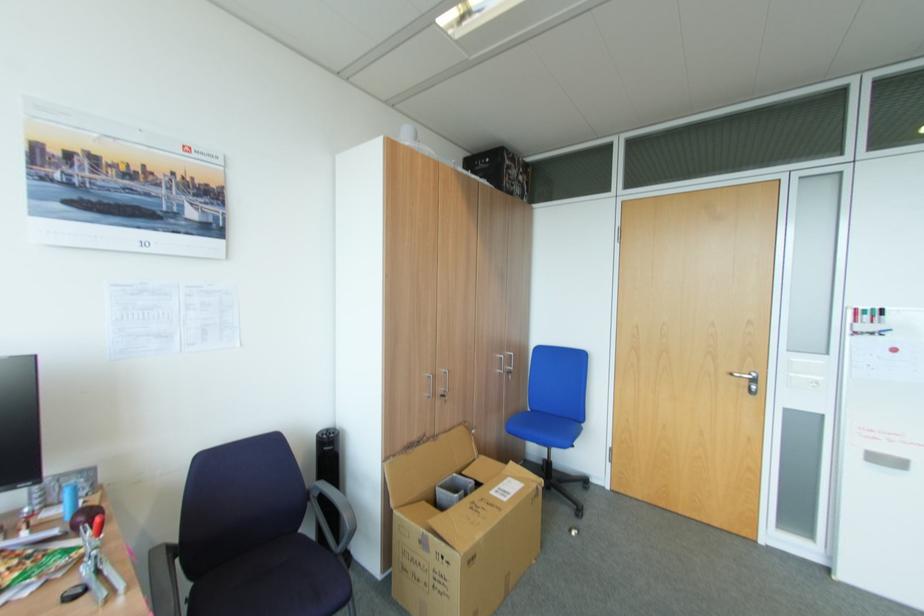
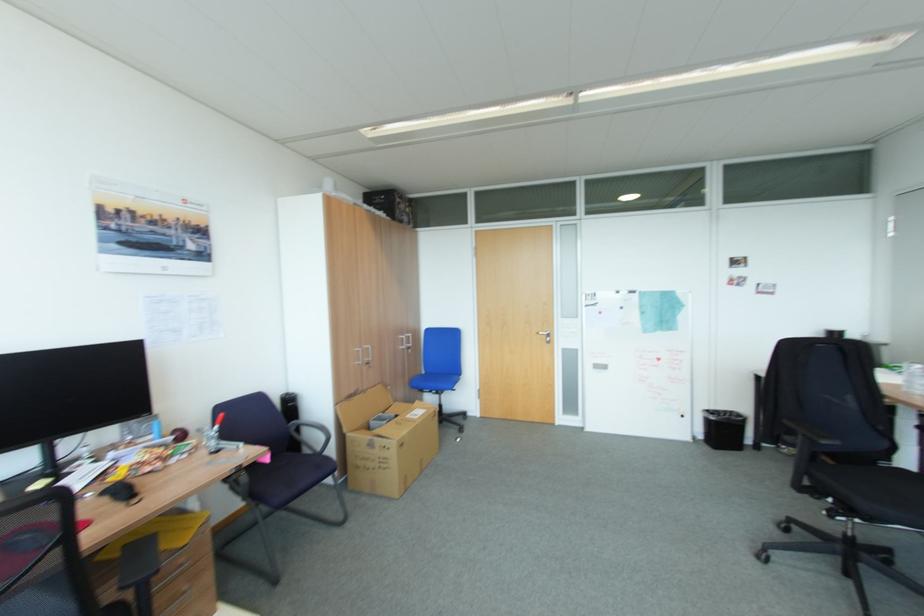
Question: Which direction would the cameraman need to move to produce the second image? Reply with the corresponding letter.

Choices:
 (A) Left
 (B) Right
 (C) Forward
 (D) Backward

Answer: (D)